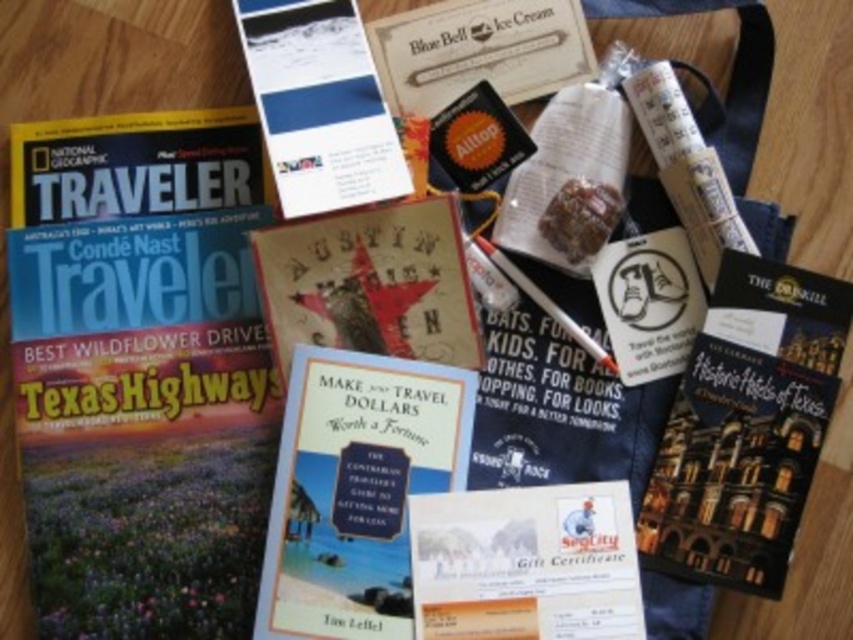
Question: Estimate the real-world distances between objects in this image. Which object is farther from the white matte pen at center?

Choices:
 (A) white paper gift certificate at center
 (B) matte paper brochure at upper center
 (C) hardcover book at center

Answer: (C)

Question: Can you confirm if white paper gift certificate at center is bigger than matte paper brochure at upper center?

Choices:
 (A) yes
 (B) no

Answer: (B)

Question: Does hardcover book at center appear on the right side of matte paper brochure at upper center?

Choices:
 (A) yes
 (B) no

Answer: (A)

Question: Estimate the real-world distances between objects in this image. Which object is closer to the matte paper brochure at upper center?

Choices:
 (A) hardcover book at center
 (B) white paper gift certificate at center

Answer: (A)

Question: Among these objects, which one is farthest from the camera?

Choices:
 (A) white paper gift certificate at center
 (B) matte paper brochure at upper center
 (C) white matte pen at center

Answer: (C)

Question: Is white paper gift certificate at center smaller than white matte pen at center?

Choices:
 (A) no
 (B) yes

Answer: (A)